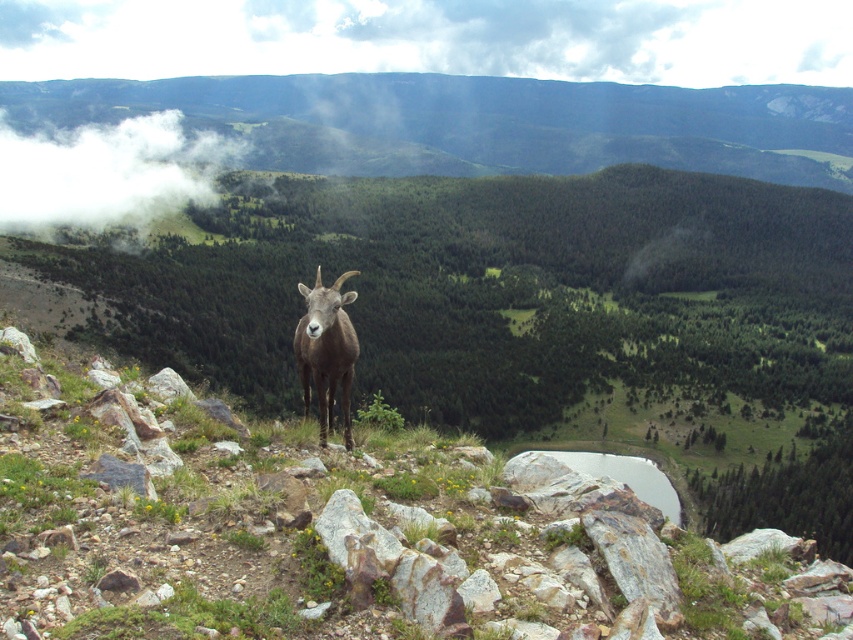
Question: Which point is farther to the camera?

Choices:
 (A) (160, 168)
 (B) (341, 312)

Answer: (A)

Question: Considering the relative positions of white fluffy cloud at upper left and brown woolly goat at center in the image provided, where is white fluffy cloud at upper left located with respect to brown woolly goat at center?

Choices:
 (A) right
 (B) left

Answer: (B)

Question: Does white fluffy cloud at upper left have a larger size compared to brown woolly goat at center?

Choices:
 (A) yes
 (B) no

Answer: (A)

Question: Can you confirm if white fluffy cloud at upper left is wider than brown woolly goat at center?

Choices:
 (A) no
 (B) yes

Answer: (B)